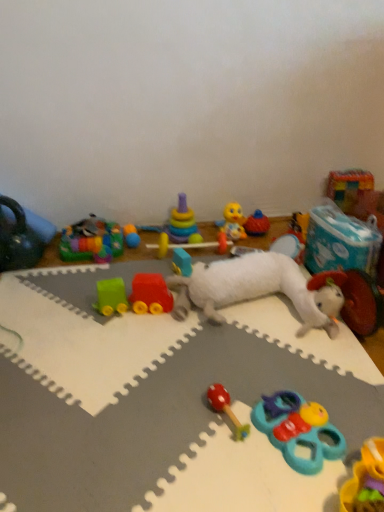
Where is `free space that is to the left of smooth red wooden rattle at center, the 9th toy in the right-to-left sequence`? The width and height of the screenshot is (384, 512). free space that is to the left of smooth red wooden rattle at center, the 9th toy in the right-to-left sequence is located at coordinates (157, 423).